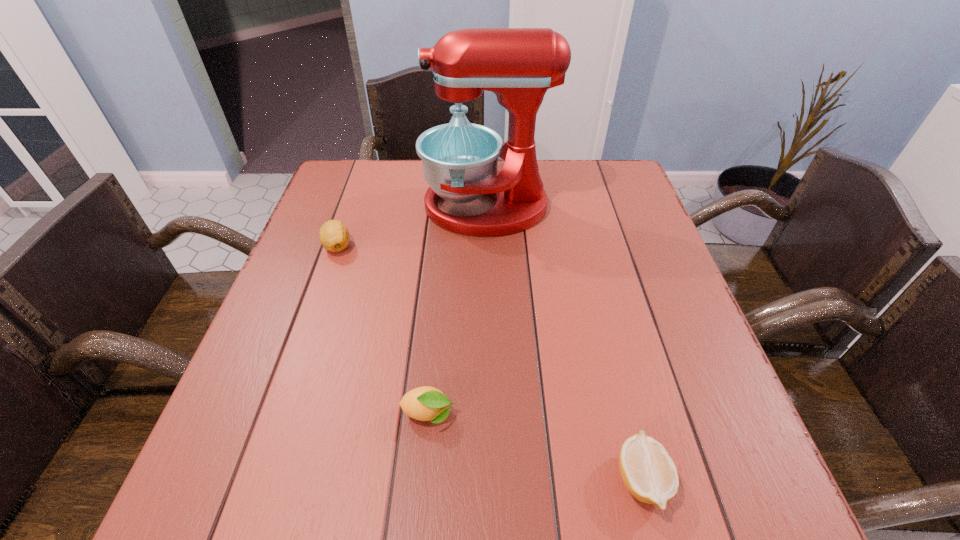
You are a GUI agent. You are given a task and a screenshot of the screen. Output one action in this format:
    pyautogui.click(x=<x>, y=<y>)
    Task: Click on the vacant position in the image that satisfies the following two spatial constraints: 1. on the front-facing side of the tallest object; 2. on the right side of the nearest object
    
    Given the screenshot: What is the action you would take?
    pyautogui.click(x=492, y=479)

Where is `vacant point that satisfies the following two spatial constraints: 1. at the stem end of the nearest object; 2. on the left side of the leftmost object`? Image resolution: width=960 pixels, height=540 pixels. vacant point that satisfies the following two spatial constraints: 1. at the stem end of the nearest object; 2. on the left side of the leftmost object is located at coordinates (256, 479).

This screenshot has width=960, height=540. I want to click on free space that satisfies the following two spatial constraints: 1. with leaves positioned above the shortest object; 2. on the right side of the second farthest lemon, so click(x=422, y=479).

The image size is (960, 540). I want to click on vacant position in the image that satisfies the following two spatial constraints: 1. with leaves positioned above the shortest lemon; 2. on the right side of the second lemon from left to right, so click(x=422, y=479).

The height and width of the screenshot is (540, 960). I want to click on free spot that satisfies the following two spatial constraints: 1. with leaves positioned above the second farthest lemon; 2. on the right side of the shortest object, so click(x=422, y=479).

You are a GUI agent. You are given a task and a screenshot of the screen. Output one action in this format:
    pyautogui.click(x=<x>, y=<y>)
    Task: Click on the blank space that satisfies the following two spatial constraints: 1. on the front-facing side of the mixer; 2. on the left side of the rightmost lemon
    The width and height of the screenshot is (960, 540).
    Given the screenshot: What is the action you would take?
    pyautogui.click(x=492, y=479)

Locate an element on the screen. vacant region that satisfies the following two spatial constraints: 1. at the stem end of the shortest object; 2. on the left side of the leftmost object is located at coordinates (256, 479).

Locate an element on the screen. free point that satisfies the following two spatial constraints: 1. on the front-facing side of the mixer; 2. at the stem end of the leftmost lemon is located at coordinates (488, 246).